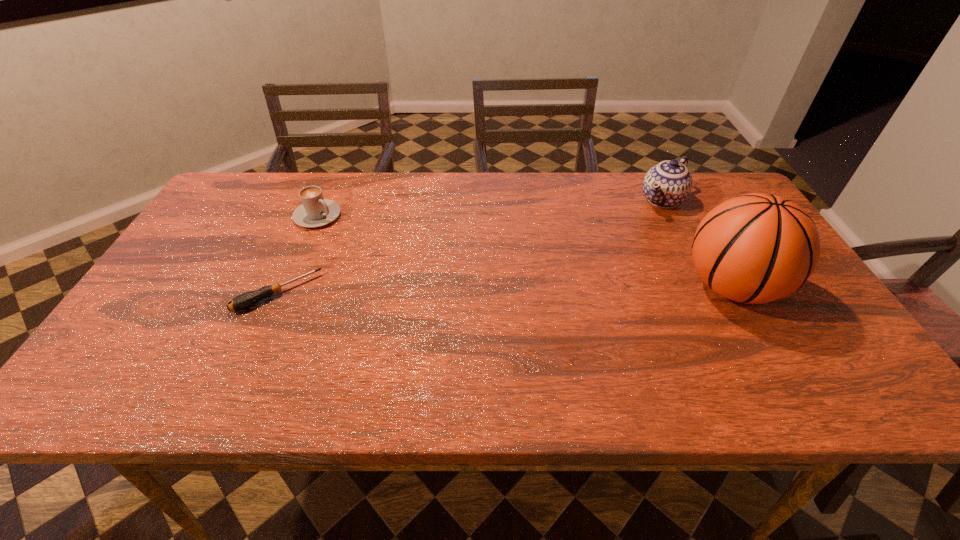
Image resolution: width=960 pixels, height=540 pixels. In order to click on vacant space at the right edge of the desktop in this screenshot , I will do `click(786, 306)`.

Where is `vacant space at the far left corner of the desktop`? vacant space at the far left corner of the desktop is located at coordinates (236, 178).

Where is `free space between the screwdriver and the basketball`? The image size is (960, 540). free space between the screwdriver and the basketball is located at coordinates (504, 290).

Locate an element on the screen. blank region between the third shortest object and the screwdriver is located at coordinates (470, 247).

You are a GUI agent. You are given a task and a screenshot of the screen. Output one action in this format:
    pyautogui.click(x=<x>, y=<y>)
    Task: Click on the free space between the shortest object and the cappuccino
    This screenshot has width=960, height=540.
    Given the screenshot: What is the action you would take?
    pyautogui.click(x=298, y=255)

The height and width of the screenshot is (540, 960). I want to click on free space between the shortest object and the cappuccino, so click(x=298, y=255).

In order to click on blank region between the basketball and the screwdriver in this screenshot , I will do `click(504, 290)`.

I want to click on unoccupied area between the screwdriver and the cappuccino, so click(298, 255).

Where is `free space between the second shortest object and the shortest object`? free space between the second shortest object and the shortest object is located at coordinates (298, 255).

At what (x,y) coordinates should I click in order to perform the action: click on free space between the cappuccino and the tallest object. Please return your answer as a coordinate pair (x, y). The height and width of the screenshot is (540, 960). Looking at the image, I should click on (524, 251).